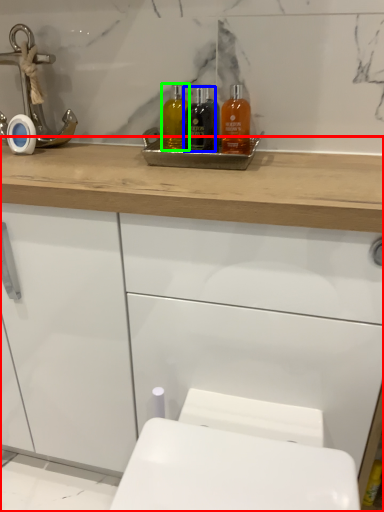
Question: Considering the real-world distances, which object is farthest from bathroom cabinet (highlighted by a red box)? mouthwash (highlighted by a blue box) or mouthwash (highlighted by a green box)?

Choices:
 (A) mouthwash
 (B) mouthwash

Answer: (B)